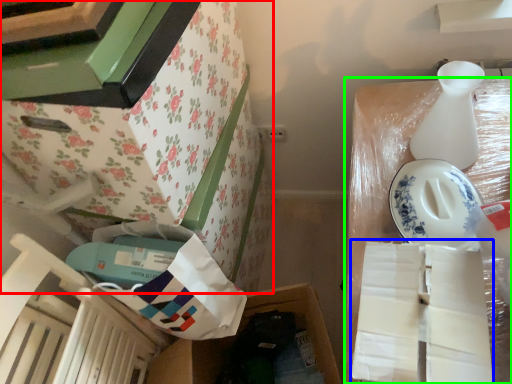
Question: Based on their relative distances, which object is nearer to furniture (highlighted by a red box)? Choose from wrapping paper (highlighted by a blue box) and storage box (highlighted by a green box).

Choices:
 (A) wrapping paper
 (B) storage box

Answer: (B)